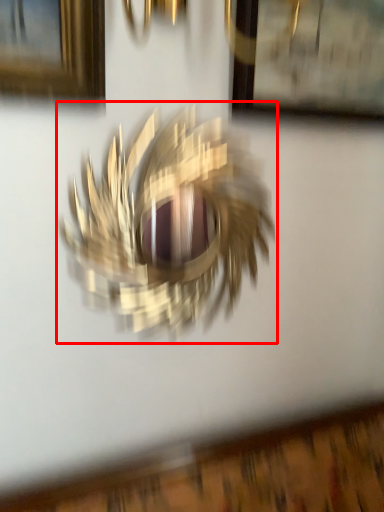
Question: From the image's perspective, what is the correct spatial positioning of bird (annotated by the red box) in reference to picture frame?

Choices:
 (A) above
 (B) below

Answer: (B)